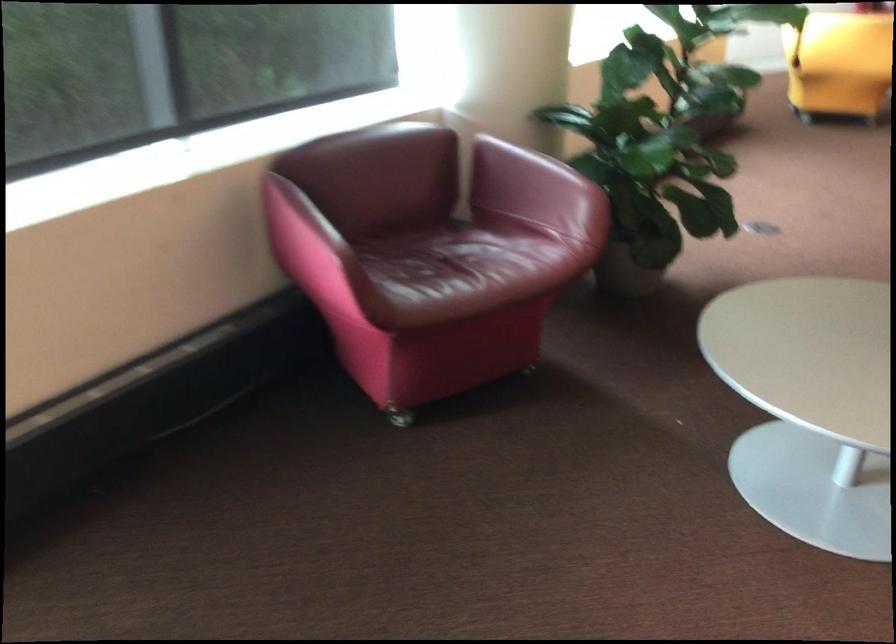
Where is `pink chair sitting surface`? pink chair sitting surface is located at coordinates (466, 266).